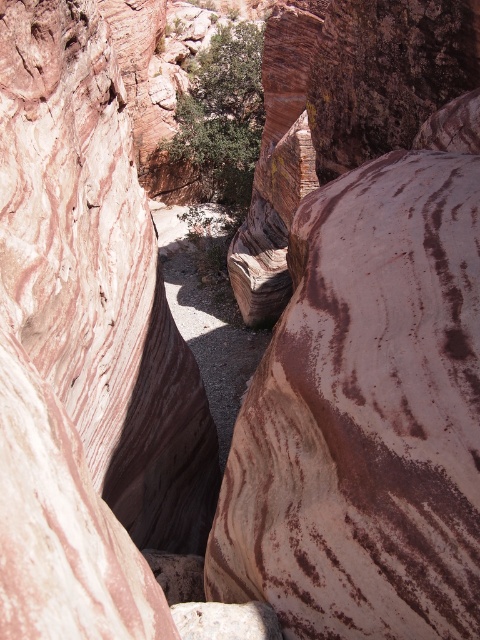
You are a hiker standing at the entrance of the canyon. You see a green leafy bush at center and a white marble rock at center. How far apart are these two landmarks from each other?

The green leafy bush at center is 179.18 feet away from the white marble rock at center.

You are a geologist examining the canyon. You notice a green leafy bush at center and a white marble rock at center. Which object is located higher in the scene?

The green leafy bush at center is positioned over the white marble rock at center, so it is higher.

From the picture: You are a hiker trying to cross the narrow canyon. You see a green leafy bush at center and a white marble rock at center. Which object is wider, making it easier to step on?

The green leafy bush at center might be wider than white marble rock at center, so it could be easier to step on.